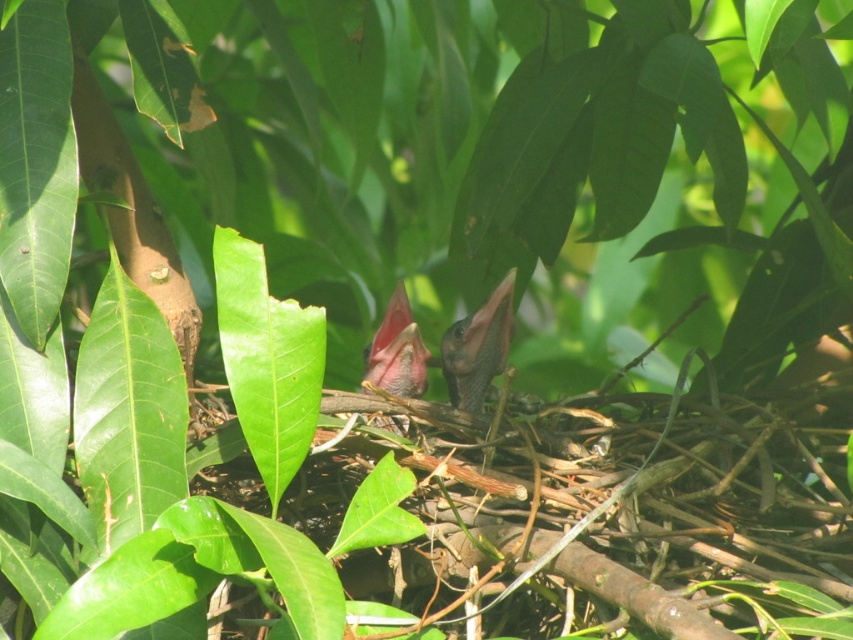
You are a photographer trying to capture the two baby birds in the nest. You notice two points of interest marked as point 1 at coordinates point (479, 369) and point 2 at coordinates point (389, 308). Which point is closer to your camera lens?

Point (389, 308) is closer to the camera lens because the description states that point (479, 369) is further away than point (389, 308).

Looking at this image, you are a birdwatcher observing two baby birds in a nest. You notice both have beaks at the center of their faces. Which beak, the smooth black beak at center or the pink matte beak at center, is closer to you?

The smooth black beak at center is closer to you because it is positioned further to the viewer than the pink matte beak at center.